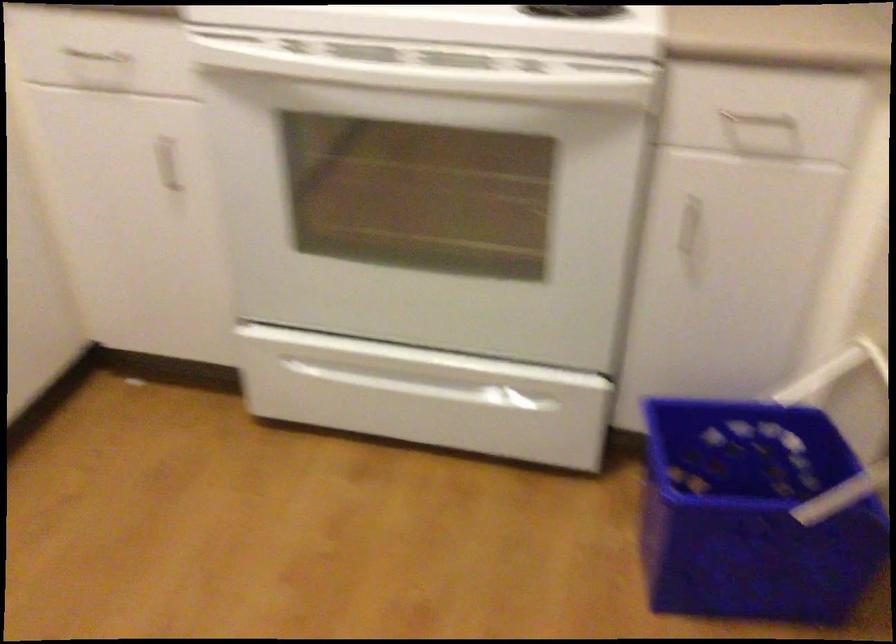
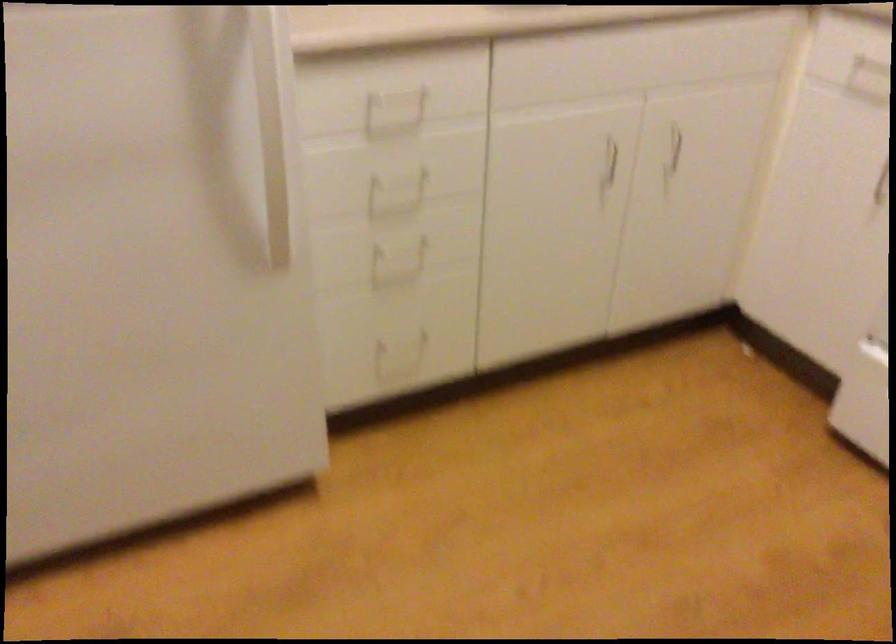
Question: The images are taken continuously from a first-person perspective. In which direction is your viewpoint rotating?

Choices:
 (A) Left
 (B) Right
 (C) Up
 (D) Down

Answer: (A)